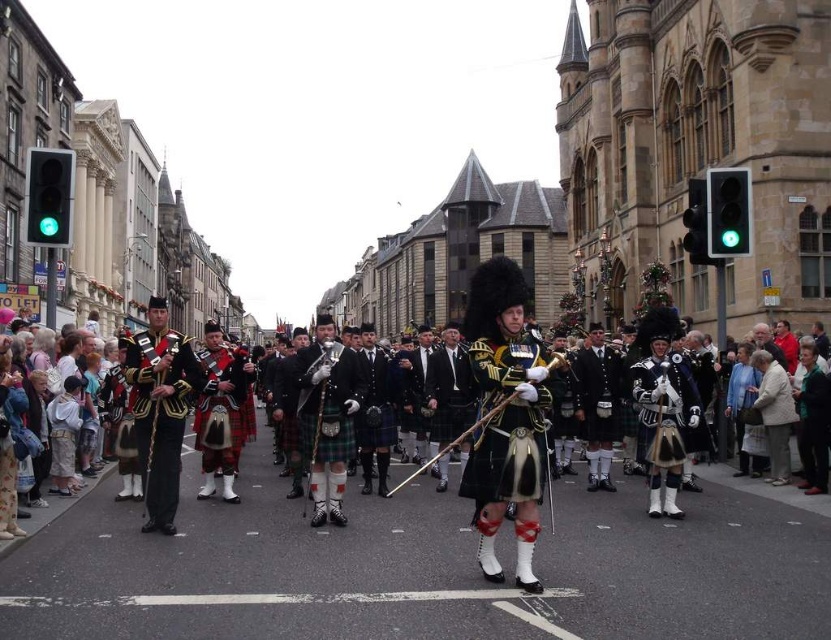
Which is in front, point (153, 481) or point (687, 204)?

Positioned in front is point (153, 481).

Does shiny gold uniform at center have a greater height compared to green glass traffic light at upper right?

Yes, shiny gold uniform at center is taller than green glass traffic light at upper right.

Which is in front, point (166, 408) or point (701, 196)?

Positioned in front is point (166, 408).

Identify the location of shiny gold uniform at center. This screenshot has height=640, width=831. (160, 410).

In the scene shown: Between matte black kilt at center and green glass traffic light at right, which one appears on the left side from the viewer's perspective?

matte black kilt at center

Locate an element on the screen. This screenshot has width=831, height=640. matte black kilt at center is located at coordinates (505, 417).

Image resolution: width=831 pixels, height=640 pixels. Find the location of `matte black kilt at center`. matte black kilt at center is located at coordinates (505, 417).

Locate an element on the screen. green glass traffic light at right is located at coordinates (726, 211).

Between green glass traffic light at right and green glass traffic light at upper right, which one is positioned higher?

green glass traffic light at upper right is higher up.

The height and width of the screenshot is (640, 831). What do you see at coordinates (726, 211) in the screenshot?
I see `green glass traffic light at right` at bounding box center [726, 211].

Image resolution: width=831 pixels, height=640 pixels. I want to click on green glass traffic light at right, so [x=726, y=211].